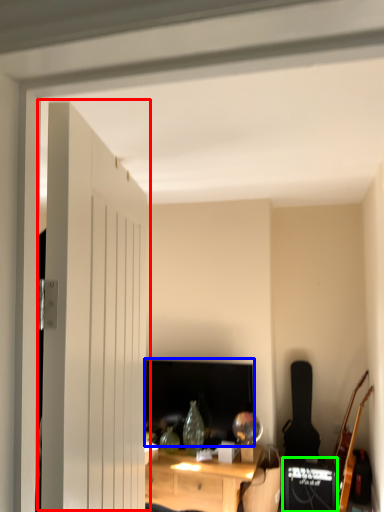
Question: Which object is positioned closest to door (highlighted by a red box)? Select from computer monitor (highlighted by a blue box) and speaker (highlighted by a green box).

Choices:
 (A) computer monitor
 (B) speaker

Answer: (A)